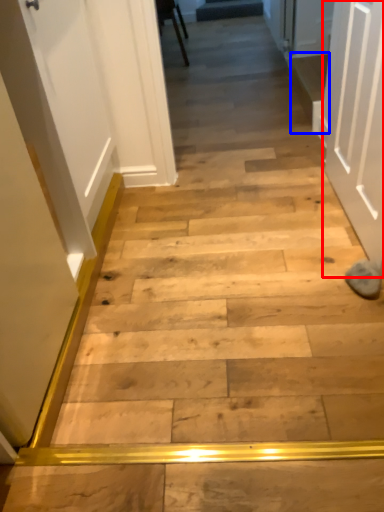
Question: Which object appears farthest to the camera in this image, door (highlighted by a red box) or stairwell (highlighted by a blue box)?

Choices:
 (A) door
 (B) stairwell

Answer: (B)